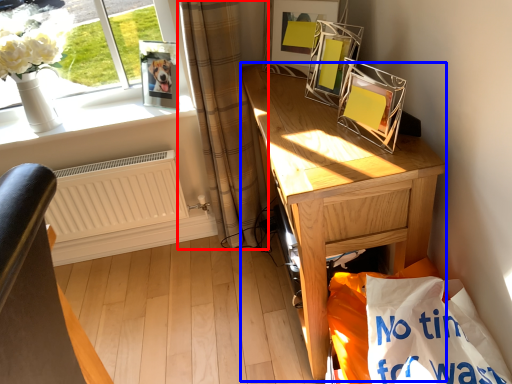
Question: Among these objects, which one is farthest to the camera, curtain (highlighted by a red box) or desk (highlighted by a blue box)?

Choices:
 (A) curtain
 (B) desk

Answer: (A)